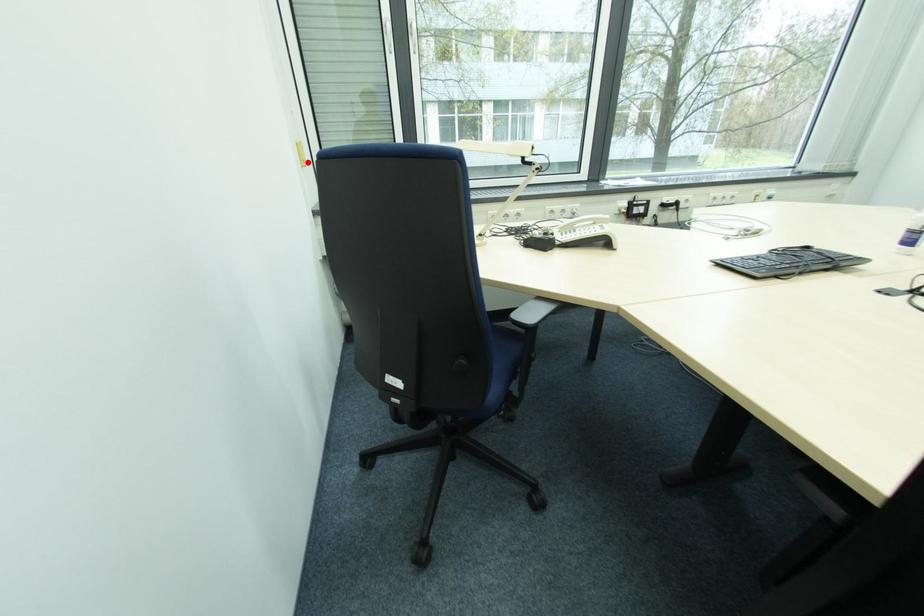
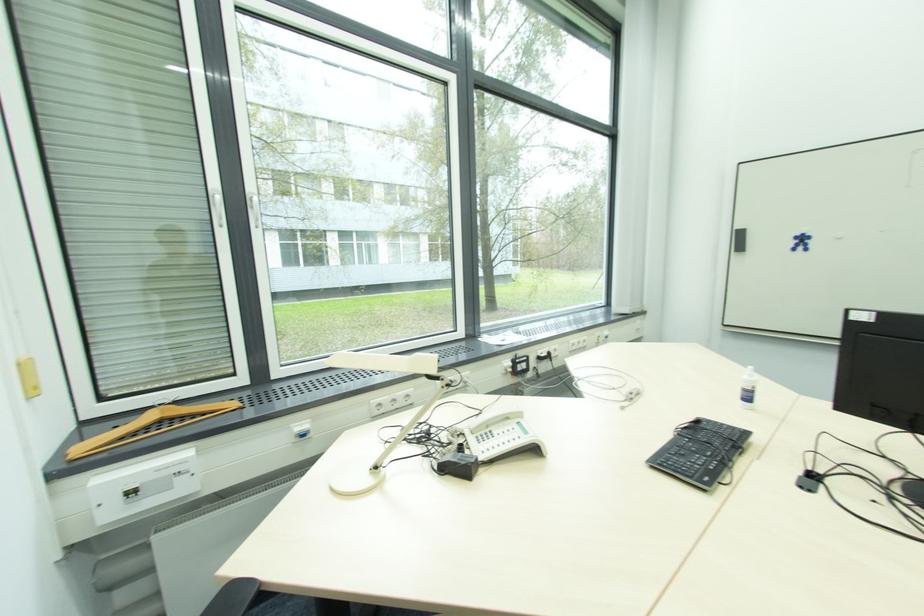
The point at the highlighted location is marked in the first image. Where is the corresponding point in the second image?

(41, 390)